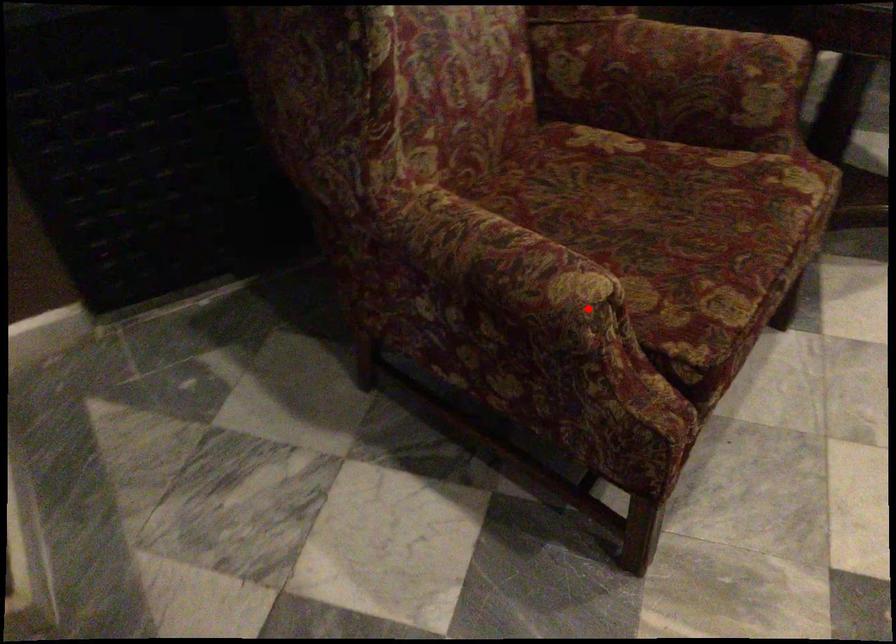
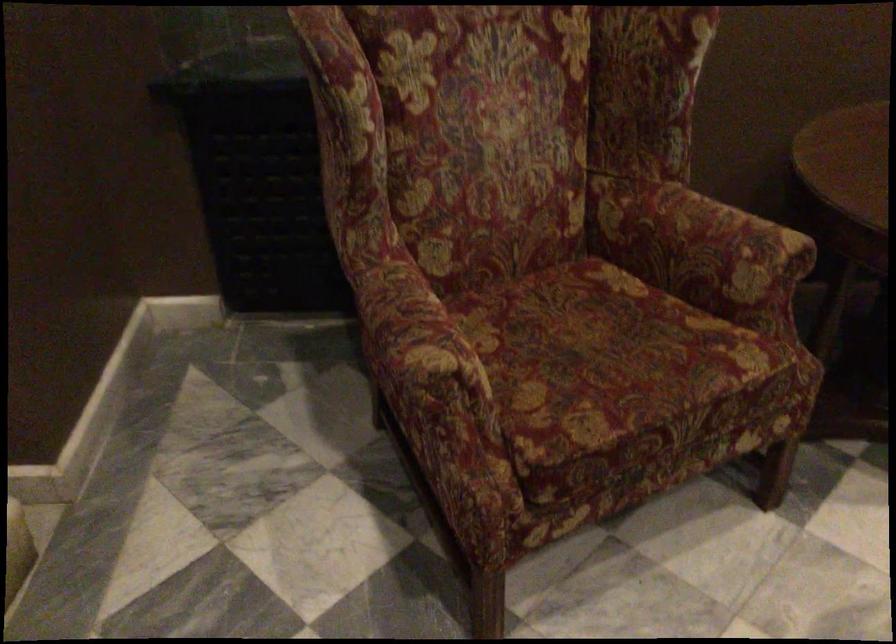
Question: I am providing you with two images of the same scene from different viewpoints. Image1 has a red point marked. In image2, the corresponding 3D location appears at what relative position? Reply with the corresponding letter.

Choices:
 (A) Closer
 (B) Farther

Answer: (B)